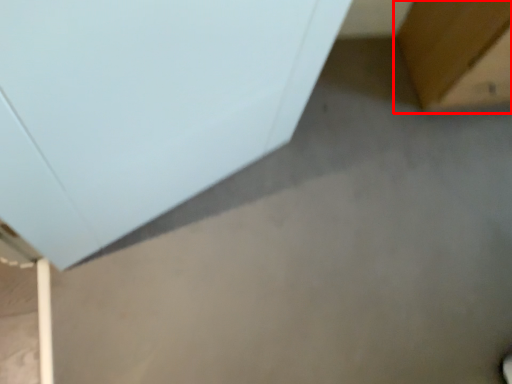
Question: From the image's perspective, what is the correct spatial relationship of furniture (annotated by the red box) in relation to furniture?

Choices:
 (A) above
 (B) below

Answer: (A)